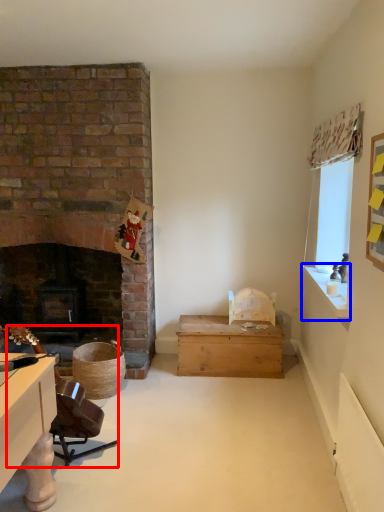
Question: Among these objects, which one is farthest to the camera, swivel chair (highlighted by a red box) or window sill (highlighted by a blue box)?

Choices:
 (A) swivel chair
 (B) window sill

Answer: (B)